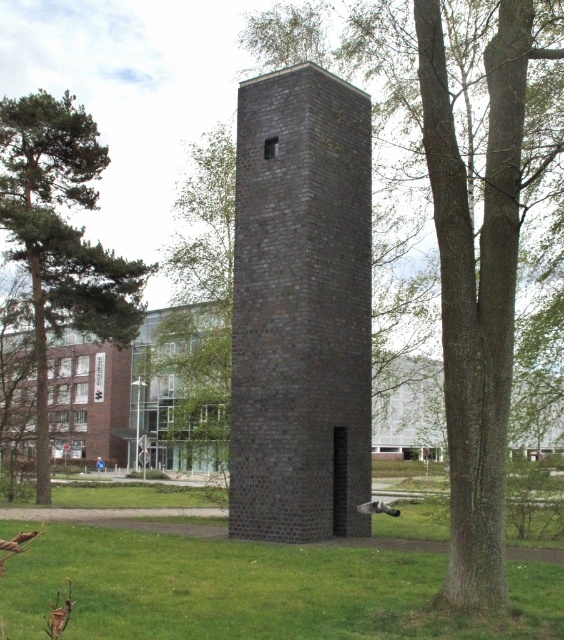
Consider the image. Is dark gray brick tower at center positioned behind green grass at center?

Yes, dark gray brick tower at center is behind green grass at center.

Between point (332, 141) and point (184, 605), which one is positioned in front?

Point (184, 605)

Locate an element on the screen. The image size is (564, 640). dark gray brick tower at center is located at coordinates (301, 308).

Does smooth bark tree at center have a larger size compared to green leafy tree at left?

Actually, smooth bark tree at center might be smaller than green leafy tree at left.

Does smooth bark tree at center lie in front of green leafy tree at left?

Yes, it is.

What do you see at coordinates (477, 291) in the screenshot?
I see `smooth bark tree at center` at bounding box center [477, 291].

Find the location of a particular element. The width and height of the screenshot is (564, 640). smooth bark tree at center is located at coordinates (477, 291).

Is dark gray brick tower at center bigger than green leafy tree at left?

Incorrect, dark gray brick tower at center is not larger than green leafy tree at left.

Measure the distance between dark gray brick tower at center and green leafy tree at left.

dark gray brick tower at center is 17.38 meters from green leafy tree at left.

At what (x,y) coordinates should I click in order to perform the action: click on dark gray brick tower at center. Please return your answer as a coordinate pair (x, y). The image size is (564, 640). Looking at the image, I should click on (301, 308).

Where is `dark gray brick tower at center`? dark gray brick tower at center is located at coordinates (301, 308).